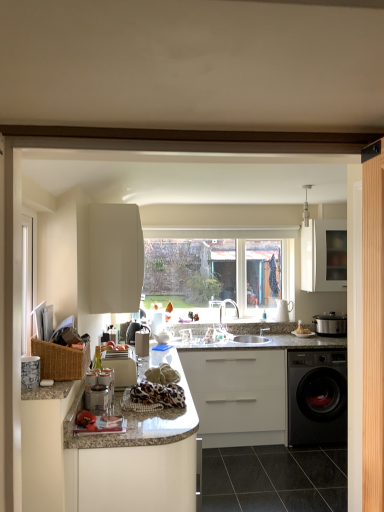
Locate an element on the screen. The height and width of the screenshot is (512, 384). empty space that is ontop of black glossy tile at lower center is located at coordinates (289, 469).